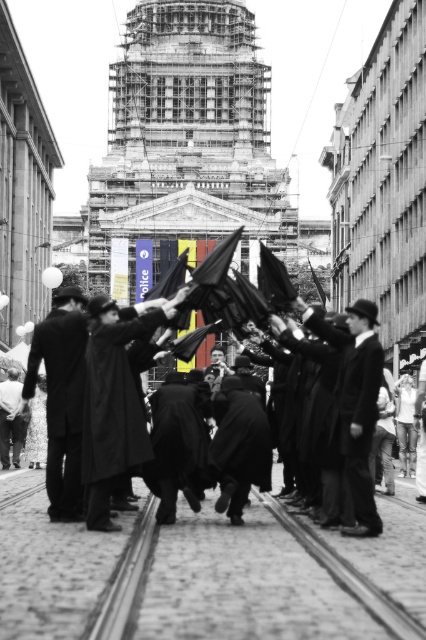
You are a costume designer preparing for a play. You have two garments to choose from for the main character. The black woolen robe at center and the dark wool coat at lower left. Which garment is narrower in width?

The black woolen robe at center is narrower in width than the dark wool coat at lower left.

You are a photographer trying to capture both the matte black coat at center and the smooth black coat at center in a single shot. Which coat should you adjust your camera angle to focus on first if you want to include both in your frame without moving the subjects?

You should focus on the smooth black coat at center first because the matte black coat at center is to its left, so adjusting the angle to include both would require framing from the right side towards the left.